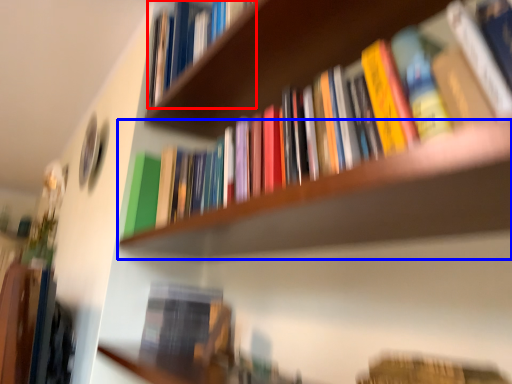
Question: Which of the following is the closest to the observer, book (highlighted by a red box) or shelf (highlighted by a blue box)?

Choices:
 (A) book
 (B) shelf

Answer: (B)